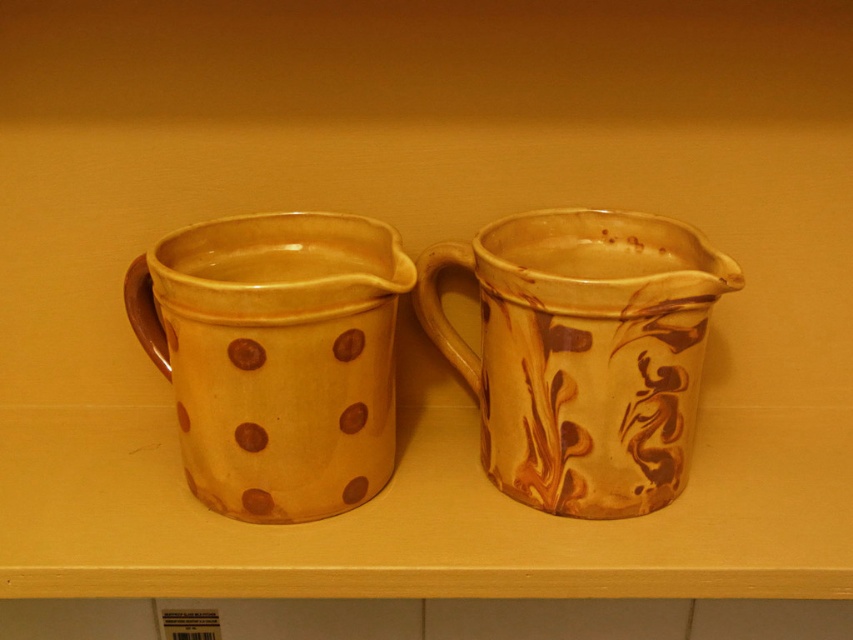
Which of these two, matte yellow clay mug at left or marbled clay pitcher at right, stands taller?

With more height is marbled clay pitcher at right.

The width and height of the screenshot is (853, 640). What do you see at coordinates (276, 356) in the screenshot? I see `matte yellow clay mug at left` at bounding box center [276, 356].

Measure the distance between point (293,244) and camera.

Point (293,244) is 31.55 inches from camera.

Locate an element on the screen. matte yellow clay mug at left is located at coordinates (276, 356).